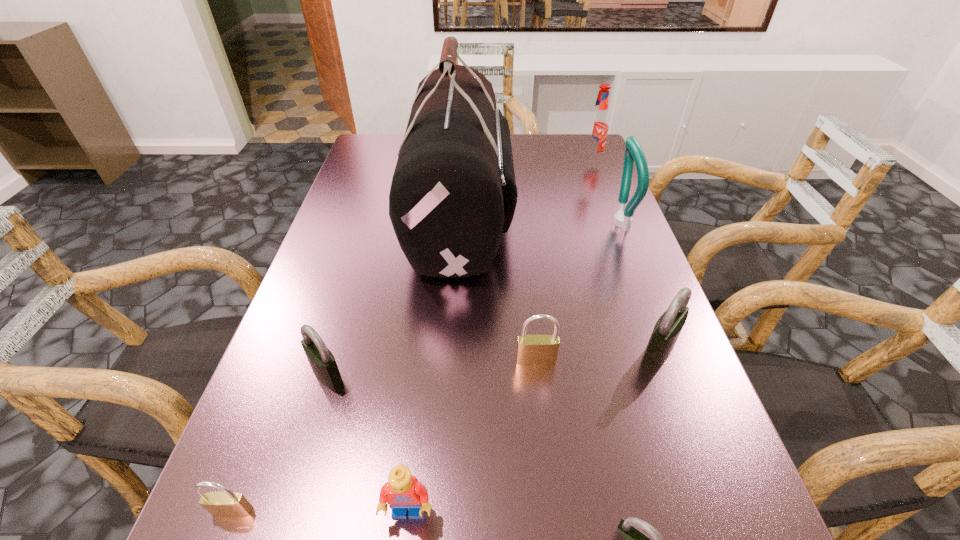
The image size is (960, 540). I want to click on free space between the green bottle opener and the eighth object from right to left, so click(472, 299).

At what (x,y) coordinates should I click in order to perform the action: click on empty space that is in between the green bottle opener and the rightmost black padlock. Please return your answer as a coordinate pair (x, y). Looking at the image, I should click on (638, 287).

Identify the location of free space between the leftmost black padlock and the duffel bag. (394, 292).

This screenshot has height=540, width=960. What are the coordinates of `vacant space that is in between the biggest black padlock and the second padlock from left to right` in the screenshot? It's located at pos(492,363).

I want to click on empty location between the red root beer and the Lego, so click(x=500, y=337).

Point out which object is positioned as the second nearest to the nearest object. Please provide its 2D coordinates. Your answer should be formatted as a tuple, i.e. [(x, y)], where the tuple contains the x and y coordinates of a point satisfying the conditions above.

[(667, 329)]

Identify which object is the closest to the nearest object. Please provide its 2D coordinates. Your answer should be formatted as a tuple, i.e. [(x, y)], where the tuple contains the x and y coordinates of a point satisfying the conditions above.

[(402, 492)]

Find the location of `the second closest padlock relative to the fourth padlock from left to right`. the second closest padlock relative to the fourth padlock from left to right is located at coordinates (532, 350).

Where is `padlock object that ranks as the second closest to the fourth object from right to left`? Image resolution: width=960 pixels, height=540 pixels. padlock object that ranks as the second closest to the fourth object from right to left is located at coordinates (532, 350).

Where is `black padlock that can be found as the third closest to the bigger brass padlock`? The height and width of the screenshot is (540, 960). black padlock that can be found as the third closest to the bigger brass padlock is located at coordinates (323, 364).